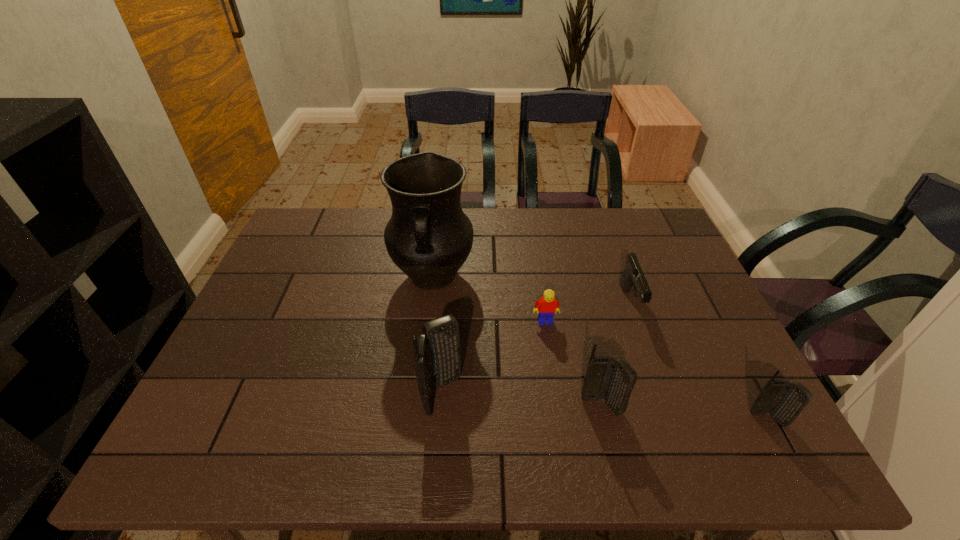
The width and height of the screenshot is (960, 540). Identify the location of vacant space at the far left corner of the desktop. (324, 249).

The height and width of the screenshot is (540, 960). I want to click on vacant space at the near right corner of the desktop, so click(x=717, y=400).

I want to click on free space between the fourth object from right to left and the fourth tallest object, so click(657, 370).

You are a GUI agent. You are given a task and a screenshot of the screen. Output one action in this format:
    pyautogui.click(x=<x>, y=<y>)
    Task: Click on the vacant space that's between the second object from right to left and the pitcher
    The image size is (960, 540).
    Given the screenshot: What is the action you would take?
    pyautogui.click(x=532, y=290)

Locate an element on the screen. The height and width of the screenshot is (540, 960). free spot between the pistol and the second tallest object is located at coordinates pos(537,348).

What are the coordinates of `free area in between the leftmost cellular telephone and the Lego` in the screenshot? It's located at (494, 357).

You are a GUI agent. You are given a task and a screenshot of the screen. Output one action in this format:
    pyautogui.click(x=<x>, y=<y>)
    Task: Click on the blank region between the second shortest cellular telephone and the fifth shortest object
    
    Given the screenshot: What is the action you would take?
    pyautogui.click(x=522, y=400)

Where is `vacant space in between the fifth object from left to right and the second tallest cellular telephone`? The image size is (960, 540). vacant space in between the fifth object from left to right and the second tallest cellular telephone is located at coordinates (616, 354).

Find the location of a particular element. Image resolution: width=960 pixels, height=540 pixels. empty space that is in between the tallest object and the third shortest object is located at coordinates (600, 348).

Locate an element on the screen. vacant space that is in between the tallest object and the fourth object from right to left is located at coordinates tap(489, 299).